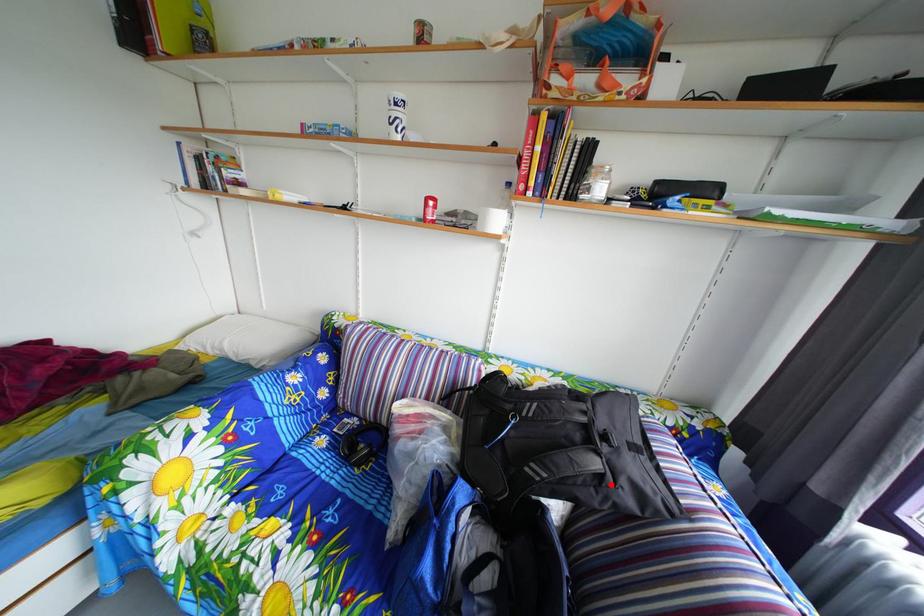
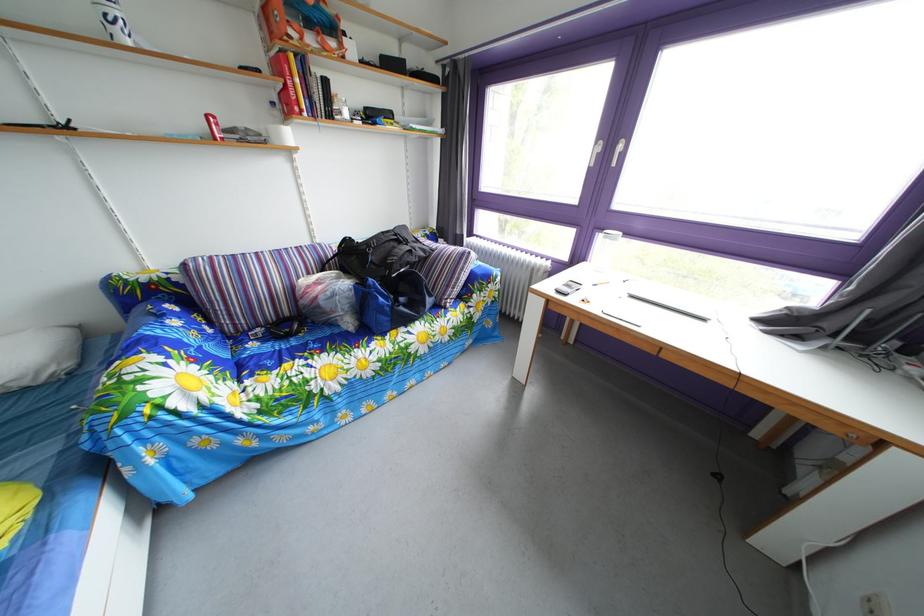
Question: I am providing you with two images of the same scene from different viewpoints. In image1, a red point is highlighted. Considering the same 3D point in image2, which of the following is correct?

Choices:
 (A) It is closer
 (B) It is farther

Answer: (A)